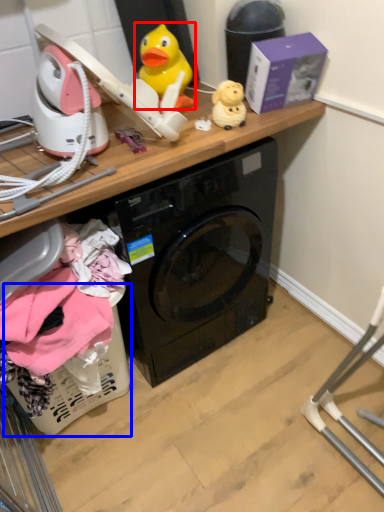
Question: Which of the following is the farthest to the observer, toy (highlighted by a red box) or basket (highlighted by a blue box)?

Choices:
 (A) toy
 (B) basket

Answer: (A)